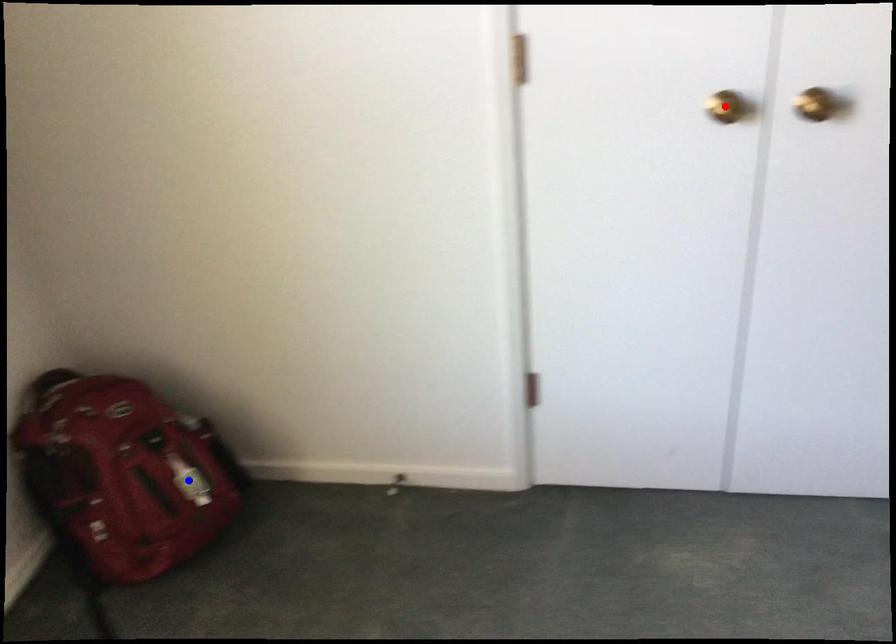
Question: Which of the two points in the image is closer to the camera?

Choices:
 (A) Blue point is closer.
 (B) Red point is closer.

Answer: (B)